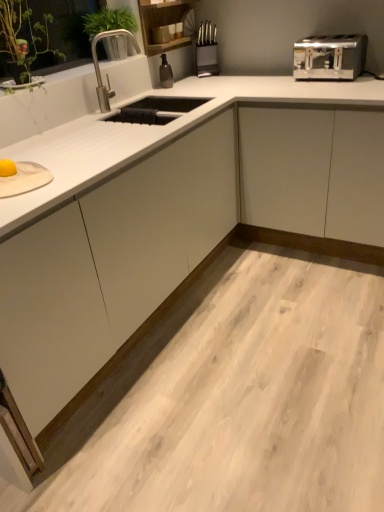
You are a GUI agent. You are given a task and a screenshot of the screen. Output one action in this format:
    pyautogui.click(x=<x>, y=<y>)
    Task: Click on the free location in front of polished stainless steel faucet at upper left
    This screenshot has height=512, width=384.
    Given the screenshot: What is the action you would take?
    pyautogui.click(x=131, y=119)